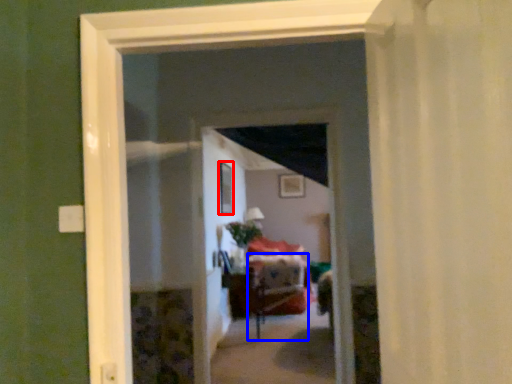
Question: Which of the following is the farthest to the observer, window (highlighted by a red box) or furniture (highlighted by a blue box)?

Choices:
 (A) window
 (B) furniture

Answer: (B)